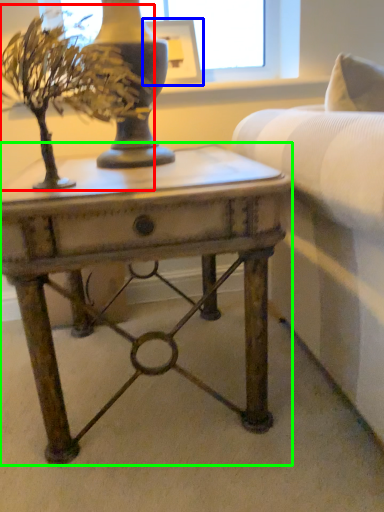
Question: Estimate the real-world distances between objects in this image. Which object is farther from houseplant (highlighted by a red box), picture frame (highlighted by a blue box) or table (highlighted by a green box)?

Choices:
 (A) picture frame
 (B) table

Answer: (A)